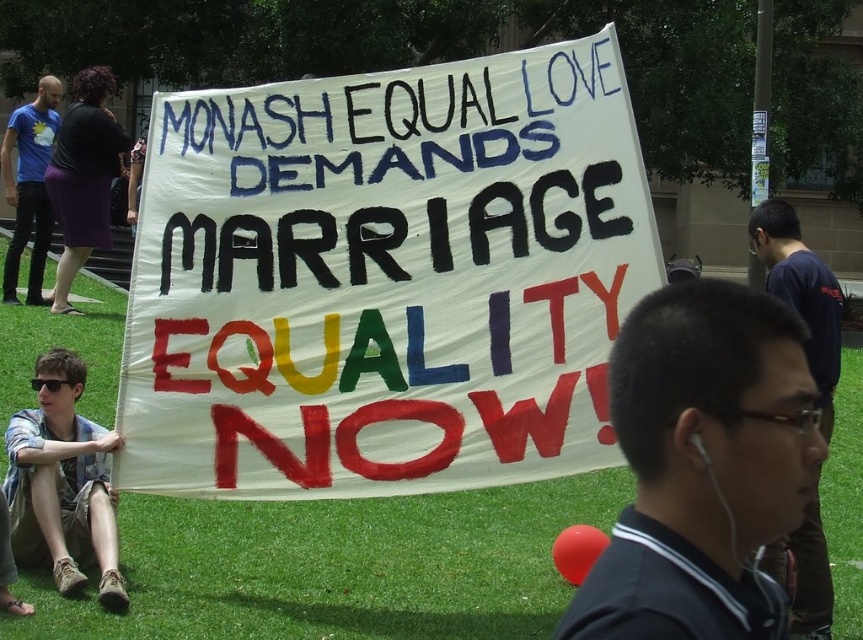
Does black fabric shirt at center have a greater height compared to blue t-shirt at left?

No, black fabric shirt at center is not taller than blue t-shirt at left.

Is black fabric shirt at center further to the viewer compared to blue t-shirt at left?

No.

Which is in front, point (681, 509) or point (22, 232)?

Positioned in front is point (681, 509).

The width and height of the screenshot is (863, 640). Identify the location of black fabric shirt at center. (702, 467).

Who is positioned more to the left, plaid shirt at lower left or dark blue shirt at center?

From the viewer's perspective, plaid shirt at lower left appears more on the left side.

Does plaid shirt at lower left have a greater width compared to dark blue shirt at center?

Indeed, plaid shirt at lower left has a greater width compared to dark blue shirt at center.

Between point (110, 429) and point (811, 508), which one is positioned in front?

Positioned in front is point (811, 508).

The image size is (863, 640). Find the location of `plaid shirt at lower left`. plaid shirt at lower left is located at coordinates (63, 484).

Which is in front, point (526, 227) or point (778, 406)?

Point (778, 406) is in front.

Is point (521, 298) positioned behind point (663, 451)?

Yes, it is.

Is point (212, 288) behind point (719, 484)?

Yes, point (212, 288) is farther from viewer.

The image size is (863, 640). In order to click on white paper sign at center in this screenshot , I will do `click(383, 280)`.